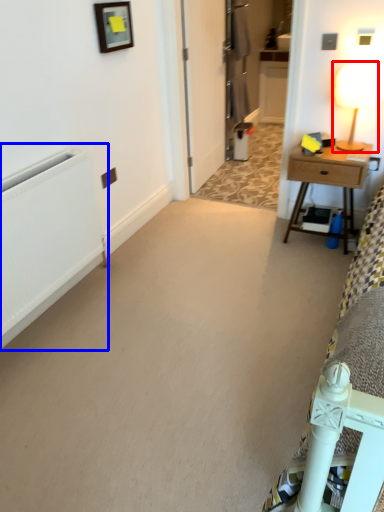
Question: Among these objects, which one is farthest to the camera, table lamp (highlighted by a red box) or radiator (highlighted by a blue box)?

Choices:
 (A) table lamp
 (B) radiator

Answer: (A)